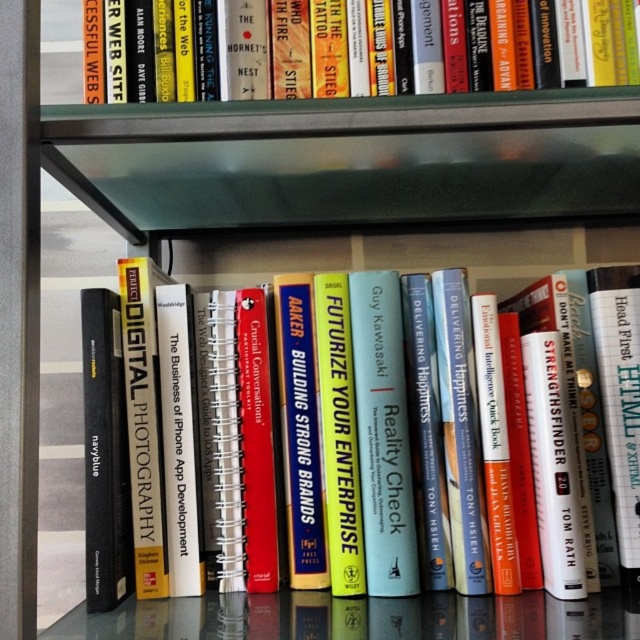
You are standing in front of the bookshelf and want to locate two specific points marked on the image. The first point is at coordinate point (346, 474) and the second is at coordinate point (193, 10). Which point is closer to you?

Point (193, 10) is closer to you because it is in front of point (346, 474).

You are a librarian who wants to reach the hardcover book at center on the shelf. Your arm can extend 50 centimeters. Can you reach it?

The hardcover book at center is 60.66 centimeters away from the viewer, which is beyond the 50 centimeter reach of your arm. You cannot reach it.

You are organizing books on a bookshelf and need to place a new book between the hardcover book at upper center and the transparent glass table at lower center. Based on their positions, where should the new book be placed?

The hardcover book at upper center is above the transparent glass table at lower center, so the new book should be placed between them on the shelf that is located above the transparent glass table at lower center.